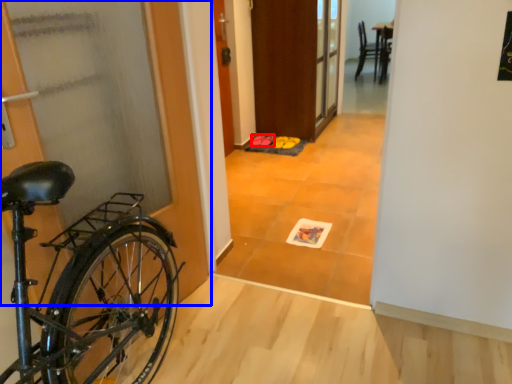
Question: Which of the following is the farthest to the observer, footwear (highlighted by a red box) or door (highlighted by a blue box)?

Choices:
 (A) footwear
 (B) door

Answer: (A)